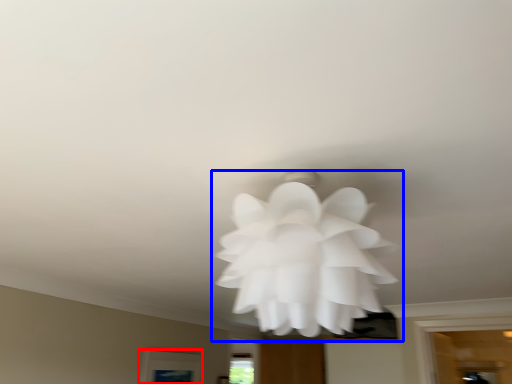
Question: Which of the following is the farthest to the observer, window (highlighted by a red box) or flower (highlighted by a blue box)?

Choices:
 (A) window
 (B) flower

Answer: (A)